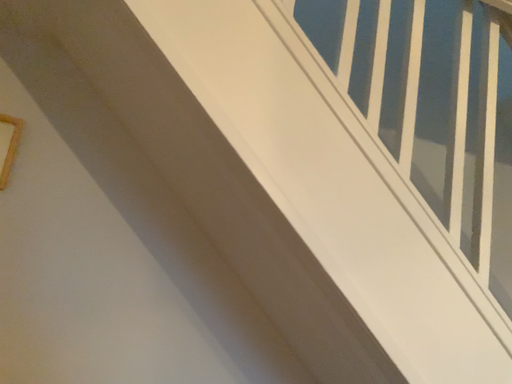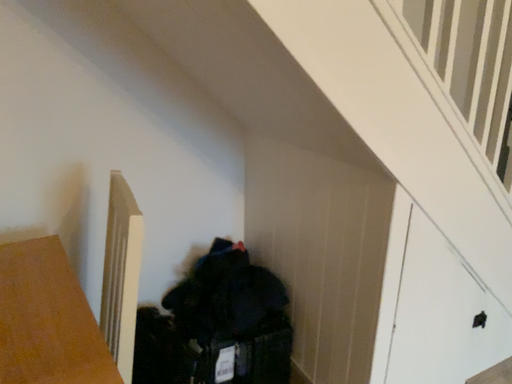
Question: How did the camera likely rotate when shooting the video?

Choices:
 (A) rotated upward
 (B) rotated downward

Answer: (B)